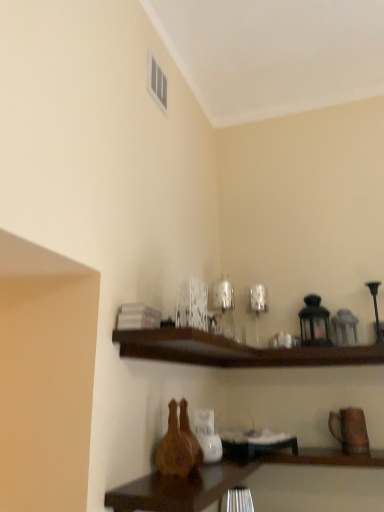
Question: Could you tell me if dark wood shelf at upper center is facing matte white vent at upper center?

Choices:
 (A) no
 (B) yes

Answer: (A)

Question: Is dark wood shelf at upper center bigger than matte white vent at upper center?

Choices:
 (A) no
 (B) yes

Answer: (B)

Question: Are dark wood shelf at upper center and matte white vent at upper center located far from each other?

Choices:
 (A) no
 (B) yes

Answer: (A)

Question: Does dark wood shelf at upper center appear on the right side of matte white vent at upper center?

Choices:
 (A) no
 (B) yes

Answer: (B)

Question: Does dark wood shelf at upper center have a greater height compared to matte white vent at upper center?

Choices:
 (A) no
 (B) yes

Answer: (A)

Question: Is dark wood shelf at upper center turned away from matte white vent at upper center?

Choices:
 (A) no
 (B) yes

Answer: (A)

Question: Is wooden table at lower center taller than matte white vent at upper center?

Choices:
 (A) yes
 (B) no

Answer: (B)

Question: Is wooden table at lower center beside matte white vent at upper center?

Choices:
 (A) yes
 (B) no

Answer: (B)

Question: Can you confirm if wooden table at lower center is smaller than matte white vent at upper center?

Choices:
 (A) yes
 (B) no

Answer: (B)

Question: Could you tell me if wooden table at lower center is facing matte white vent at upper center?

Choices:
 (A) yes
 (B) no

Answer: (B)

Question: Is wooden table at lower center closer to the viewer compared to matte white vent at upper center?

Choices:
 (A) yes
 (B) no

Answer: (A)

Question: Is wooden table at lower center at the left side of matte white vent at upper center?

Choices:
 (A) no
 (B) yes

Answer: (A)

Question: From the image's perspective, is wooden table at lower center beneath dark wood shelf at upper center?

Choices:
 (A) yes
 (B) no

Answer: (A)